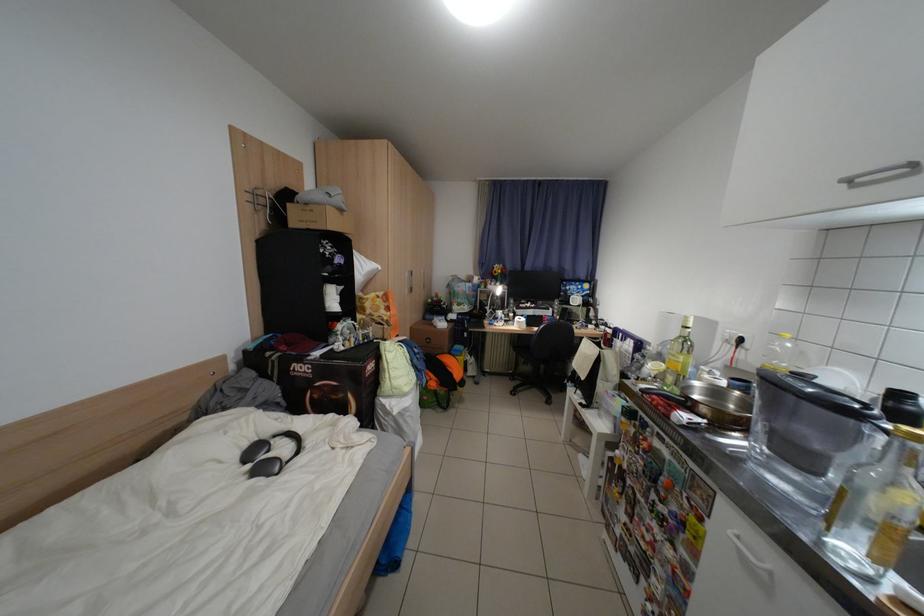
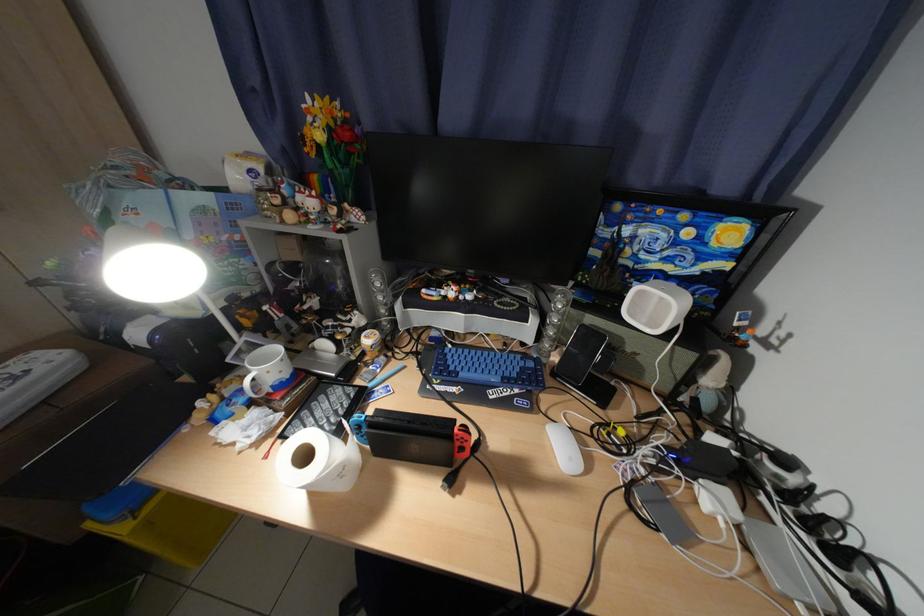
The point at (579,289) is marked in the first image. Where is the corresponding point in the second image?

(638, 233)